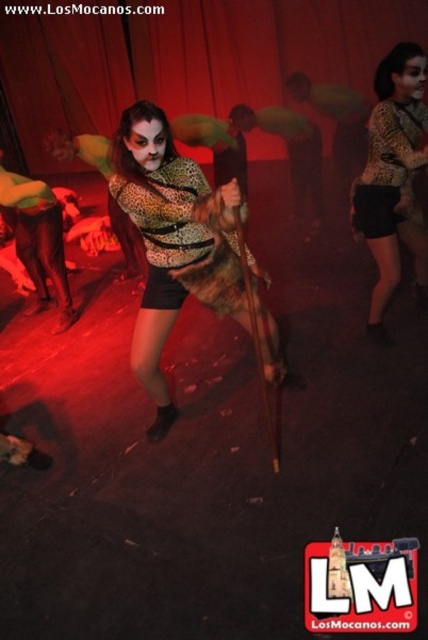
Question: Which point is farther to the camera?

Choices:
 (A) leopard print top at center
 (B) leopard print blouse at center

Answer: (B)

Question: Can you confirm if leopard print top at center is thinner than leopard print blouse at center?

Choices:
 (A) no
 (B) yes

Answer: (A)

Question: Is leopard print top at center positioned before leopard print blouse at center?

Choices:
 (A) no
 (B) yes

Answer: (B)

Question: In this image, where is leopard print top at center located relative to leopard print blouse at center?

Choices:
 (A) left
 (B) right

Answer: (A)

Question: Which object appears closest to the camera in this image?

Choices:
 (A) leopard print blouse at center
 (B) leopard print top at center

Answer: (B)

Question: Which point is farther to the camera?

Choices:
 (A) (379, 305)
 (B) (169, 285)

Answer: (A)